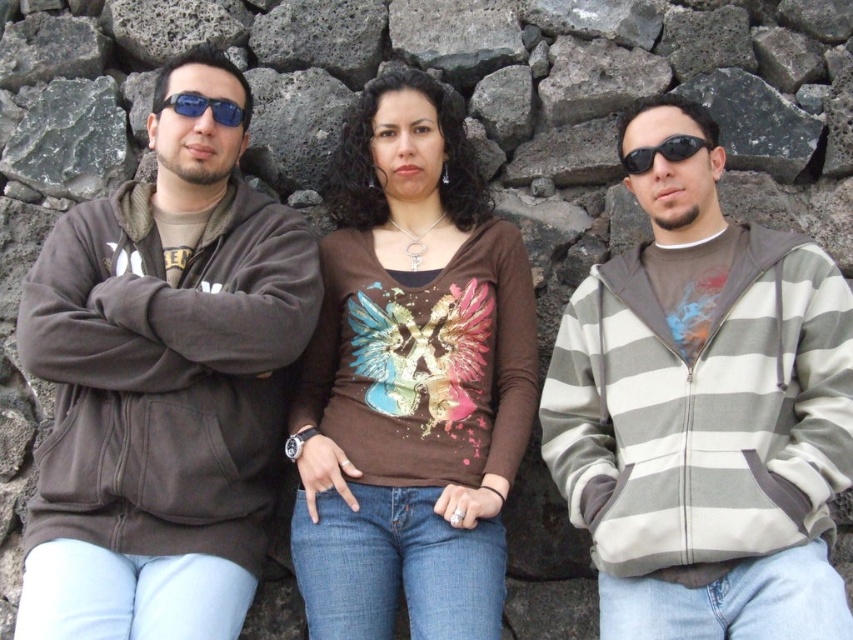
Can you confirm if matte brown hoodie at left is thinner than black plastic sunglasses at center?

In fact, matte brown hoodie at left might be wider than black plastic sunglasses at center.

Which is behind, point (76, 435) or point (628, 150)?

The point (628, 150) is more distant.

The height and width of the screenshot is (640, 853). In order to click on matte brown hoodie at left in this screenshot , I will do click(163, 384).

The width and height of the screenshot is (853, 640). What do you see at coordinates (206, 108) in the screenshot? I see `blue reflective sunglasses at center` at bounding box center [206, 108].

Is the position of blue reflective sunglasses at center less distant than that of black plastic sunglasses at center?

No, it is not.

Is point (229, 120) positioned behind point (695, 141)?

Yes, it is.

Locate an element on the screen. This screenshot has height=640, width=853. blue reflective sunglasses at center is located at coordinates (206, 108).

Between matte brown hoodie at left and blue reflective sunglasses at center, which one has less height?

blue reflective sunglasses at center is shorter.

Can you confirm if matte brown hoodie at left is positioned to the left of blue reflective sunglasses at center?

Yes, matte brown hoodie at left is to the left of blue reflective sunglasses at center.

At what (x,y) coordinates should I click in order to perform the action: click on matte brown hoodie at left. Please return your answer as a coordinate pair (x, y). The width and height of the screenshot is (853, 640). Looking at the image, I should click on (163, 384).

Locate an element on the screen. matte brown hoodie at left is located at coordinates (163, 384).